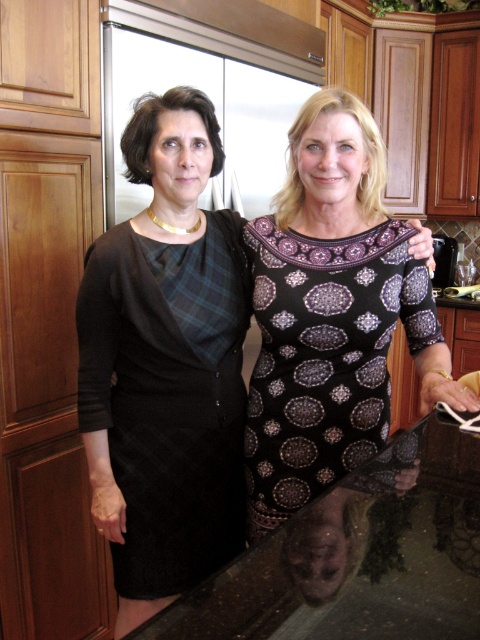
Is black textured dress at center taller than black wool dress at left?

Indeed, black textured dress at center has a greater height compared to black wool dress at left.

Is point (121, 598) positioned after point (98, 337)?

Yes.

Who is more forward, (154, 358) or (110, 400)?

Point (154, 358)

This screenshot has height=640, width=480. What are the coordinates of `black textured dress at center` in the screenshot? It's located at (165, 364).

Looking at this image, which is above, black wool dress at left or shiny black countertop at lower center?

black wool dress at left

Can you confirm if black wool dress at left is shorter than shiny black countertop at lower center?

No.

Is point (230, 417) farther from viewer compared to point (372, 547)?

Yes.

This screenshot has width=480, height=640. I want to click on black wool dress at left, so click(x=163, y=416).

Is black textured dress at center taller than shiny black countertop at lower center?

Yes.

Does black textured dress at center appear on the left side of shiny black countertop at lower center?

Yes, black textured dress at center is to the left of shiny black countertop at lower center.

The height and width of the screenshot is (640, 480). What are the coordinates of `black textured dress at center` in the screenshot? It's located at (165, 364).

You are a GUI agent. You are given a task and a screenshot of the screen. Output one action in this format:
    pyautogui.click(x=<x>, y=<y>)
    Task: Click on the black textured dress at center
    This screenshot has width=480, height=640.
    Given the screenshot: What is the action you would take?
    pyautogui.click(x=165, y=364)